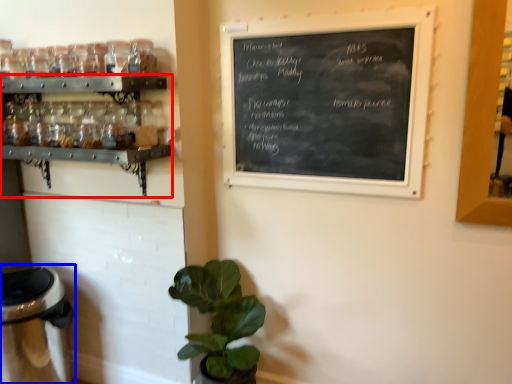
Question: Which point is further to the camera, shelf (highlighted by a red box) or appliance (highlighted by a blue box)?

Choices:
 (A) shelf
 (B) appliance

Answer: (B)